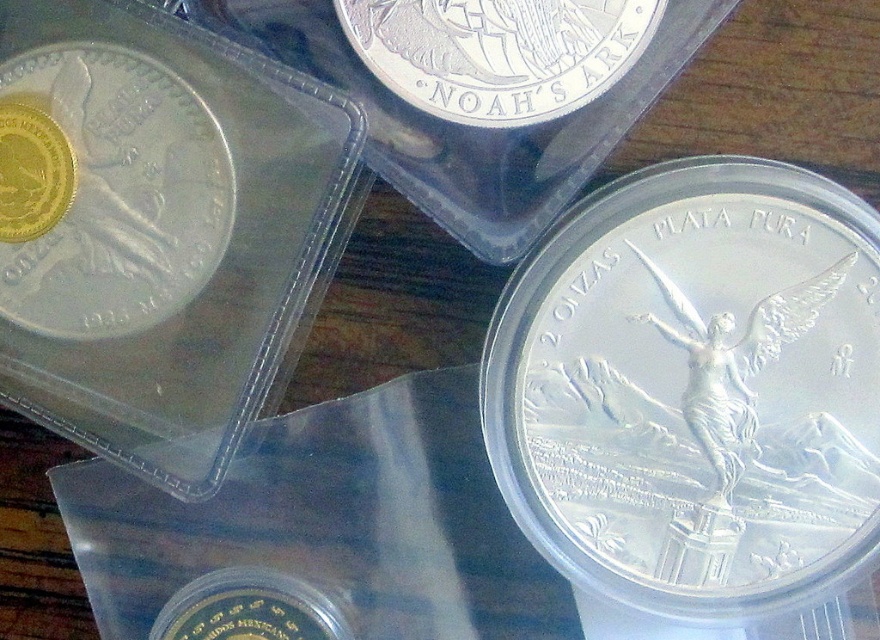
Is silver/highly polished coin at upper center to the right of gold plated coin at lower left from the viewer's perspective?

Correct, you'll find silver/highly polished coin at upper center to the right of gold plated coin at lower left.

Is silver/highly polished coin at upper center above gold plated coin at lower left?

Yes, silver/highly polished coin at upper center is above gold plated coin at lower left.

Find the location of a particular element. silver/highly polished coin at upper center is located at coordinates (497, 52).

Is satin silver coin at center behind matte silver coin at left?

No, satin silver coin at center is in front of matte silver coin at left.

Is satin silver coin at center smaller than matte silver coin at left?

No.

Who is more distant from viewer, (x=602, y=371) or (x=112, y=241)?

Point (x=112, y=241)

Where is `satin silver coin at center`? The width and height of the screenshot is (880, 640). satin silver coin at center is located at coordinates 694,387.

Who is taller, matte silver coin at left or gold plated coin at lower left?

matte silver coin at left

Based on the photo, does matte silver coin at left come in front of gold plated coin at lower left?

Yes, matte silver coin at left is closer to the viewer.

Identify the location of matte silver coin at left. This screenshot has height=640, width=880. (105, 192).